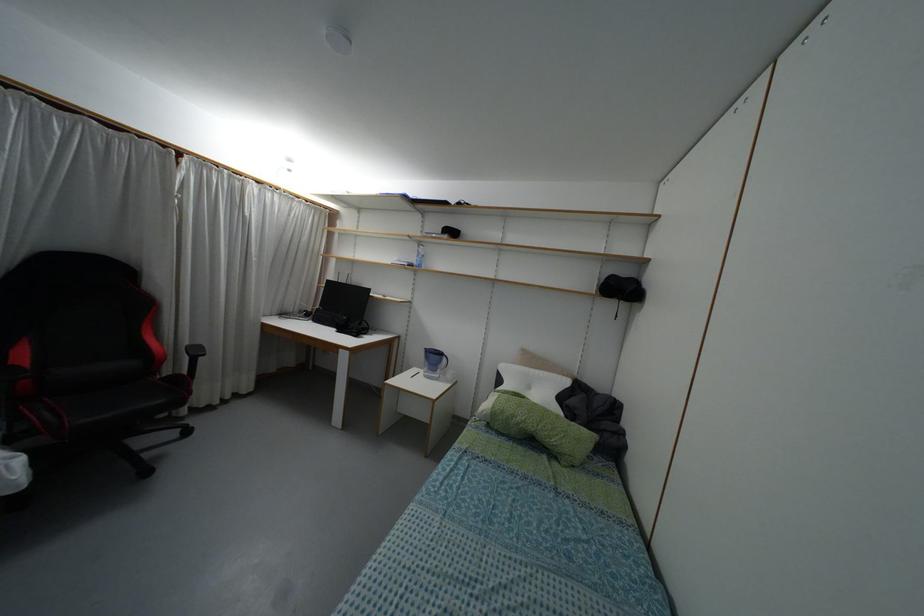
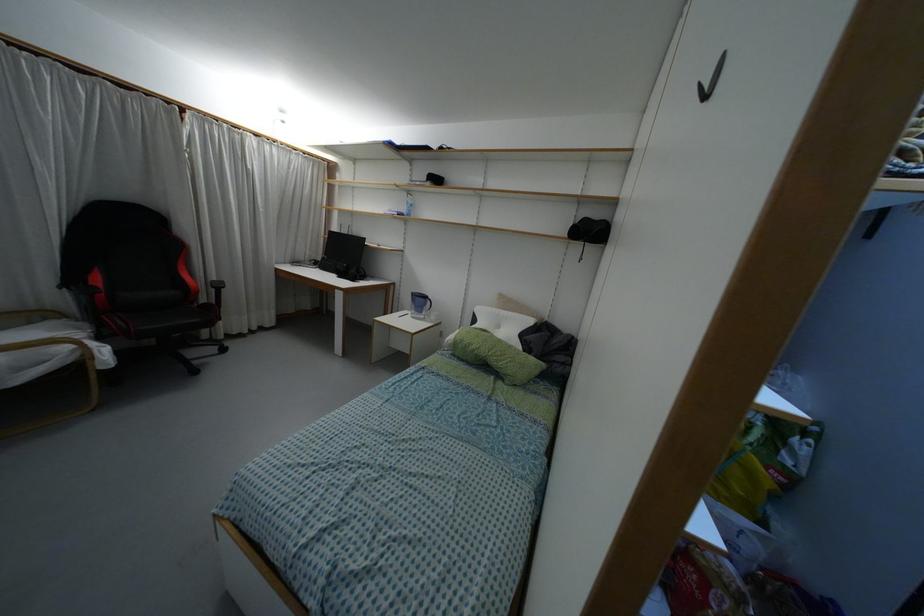
The point at (526, 369) is marked in the first image. Where is the corresponding point in the second image?

(496, 310)